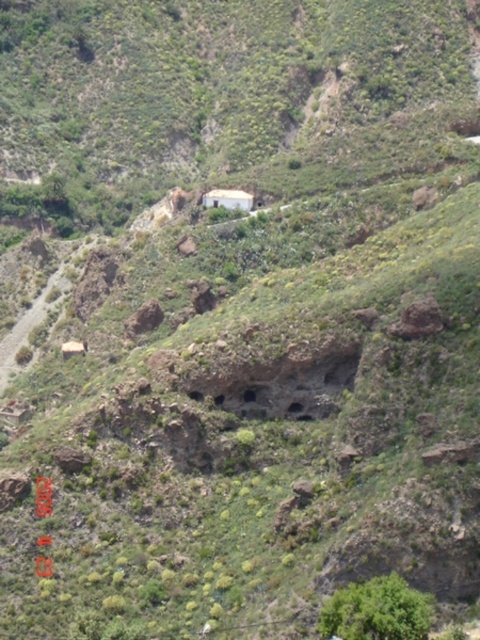
Is point (372, 589) closer to viewer compared to point (226, 205)?

Yes, it is in front of point (226, 205).

Does green leafy bush at lower right have a greater width compared to white matte hut at center?

Yes.

Identify the location of green leafy bush at lower right. The image size is (480, 640). (376, 611).